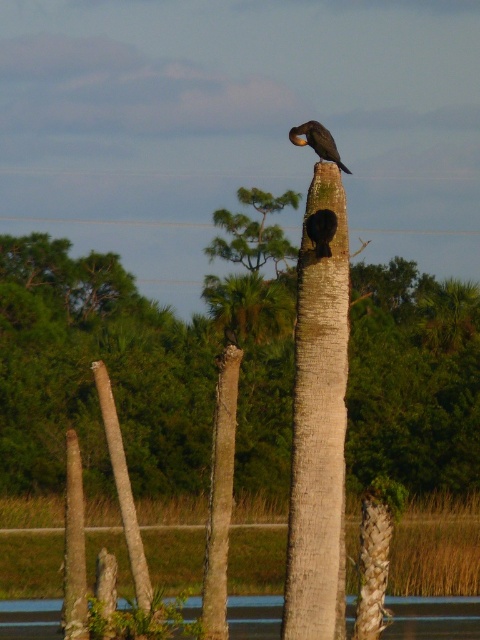
At what (x,y) coordinates should I click in order to perform the action: click on brown rough tree trunk at center. Please return your answer as a coordinate pair (x, y). This screenshot has height=640, width=480. Looking at the image, I should click on (219, 497).

Who is more forward, [207,545] or [317,253]?

Point [317,253] is more forward.

The width and height of the screenshot is (480, 640). In order to click on brown rough tree trunk at center in this screenshot , I will do `click(219, 497)`.

Who is more distant from viewer, (416, 456) or (248, 193)?

The point (248, 193) is behind.

Looking at this image, who is more forward, (x=187, y=481) or (x=243, y=259)?

Point (x=187, y=481)

Does point (87, 317) come behind point (257, 200)?

No, (87, 317) is closer to viewer.

Where is `smooth brown tree trunk at center`? This screenshot has height=640, width=480. smooth brown tree trunk at center is located at coordinates (90, 374).

Is point (223, 214) positioned behind point (297, 138)?

Yes, it is.

Identify the location of green leafy tree at center. The image size is (480, 640). (252, 230).